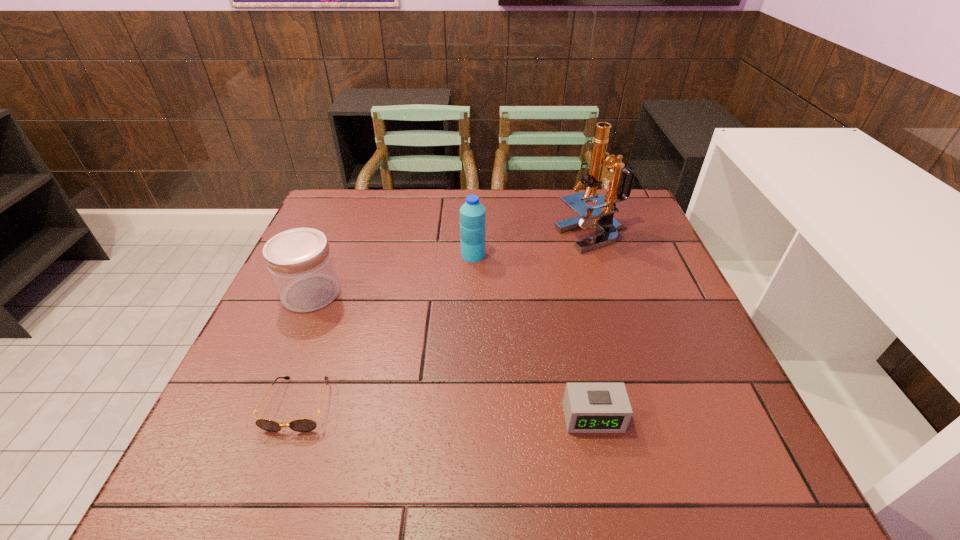
The height and width of the screenshot is (540, 960). I want to click on vacant space in between the microscope and the alarm clock, so click(x=593, y=327).

At what (x,y) coordinates should I click in order to perform the action: click on free spot between the alarm clock and the sunglasses. Please return your answer as a coordinate pair (x, y). Looking at the image, I should click on (445, 411).

Where is `vacant area between the third object from right to left and the alarm clock`? vacant area between the third object from right to left and the alarm clock is located at coordinates (533, 336).

You are a GUI agent. You are given a task and a screenshot of the screen. Output one action in this format:
    pyautogui.click(x=<x>, y=<y>)
    Task: Click on the vacant point located between the tallest object and the alarm clock
    
    Given the screenshot: What is the action you would take?
    pyautogui.click(x=593, y=327)

This screenshot has height=540, width=960. I want to click on vacant area that lies between the microscope and the second shortest object, so click(x=593, y=327).

The width and height of the screenshot is (960, 540). In order to click on object identified as the second closest to the third tallest object in this screenshot , I will do `click(472, 213)`.

The image size is (960, 540). I want to click on object that is the fourth closest to the sunglasses, so click(x=619, y=181).

This screenshot has height=540, width=960. I want to click on vacant space that satisfies the following two spatial constraints: 1. at the eyepiece of the tallest object; 2. on the front-facing side of the shortest object, so click(648, 405).

At what (x,y) coordinates should I click in order to perform the action: click on vacant space that satisfies the following two spatial constraints: 1. at the eyepiece of the microscope; 2. on the front-facing side of the alarm clock. Please return your answer as a coordinate pair (x, y). The height and width of the screenshot is (540, 960). Looking at the image, I should click on (653, 417).